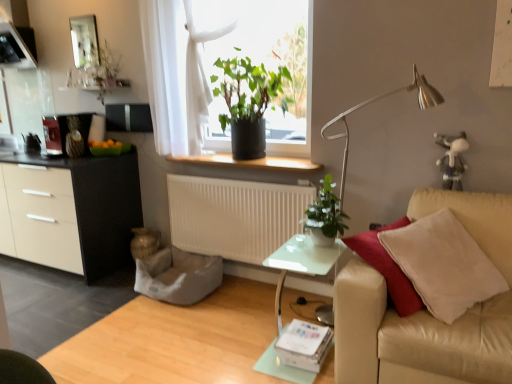
Locate an element on the screen. free space to the left of gray fabric swivel chair at lower center is located at coordinates (99, 297).